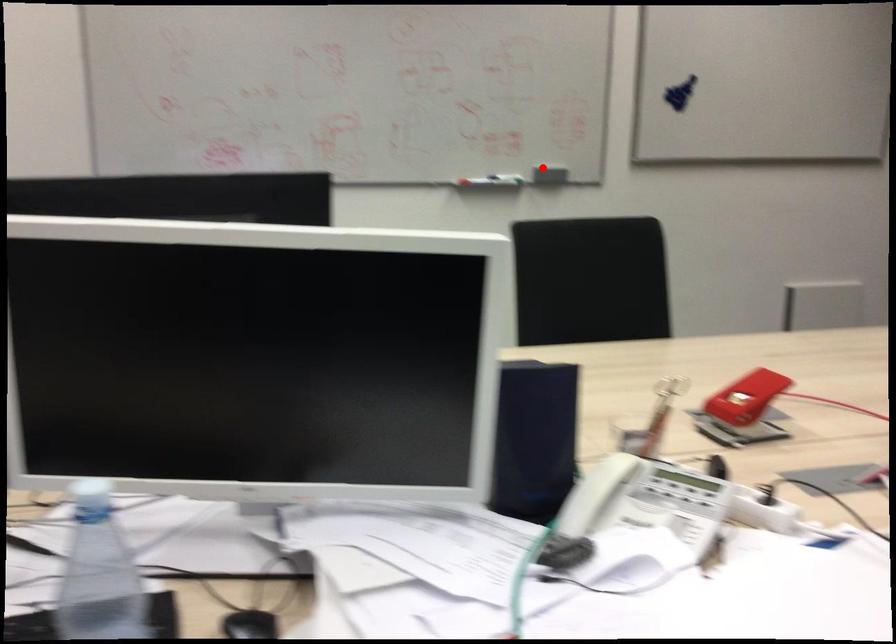
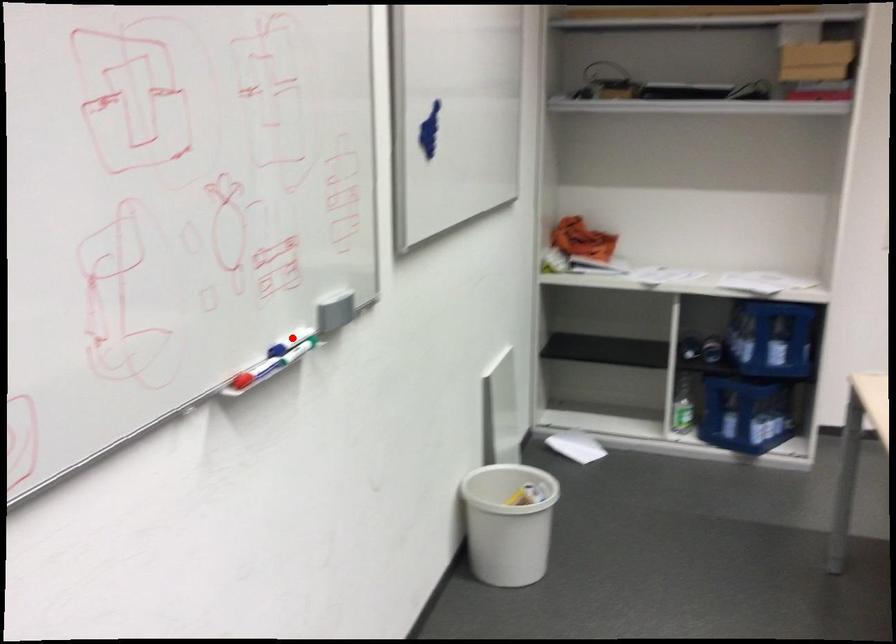
I am providing you with two images of the same scene from different viewpoints. A red point is marked on the first image and another point is marked on the second image. Is the marked point in image1 the same physical position as the marked point in image2?

Yes